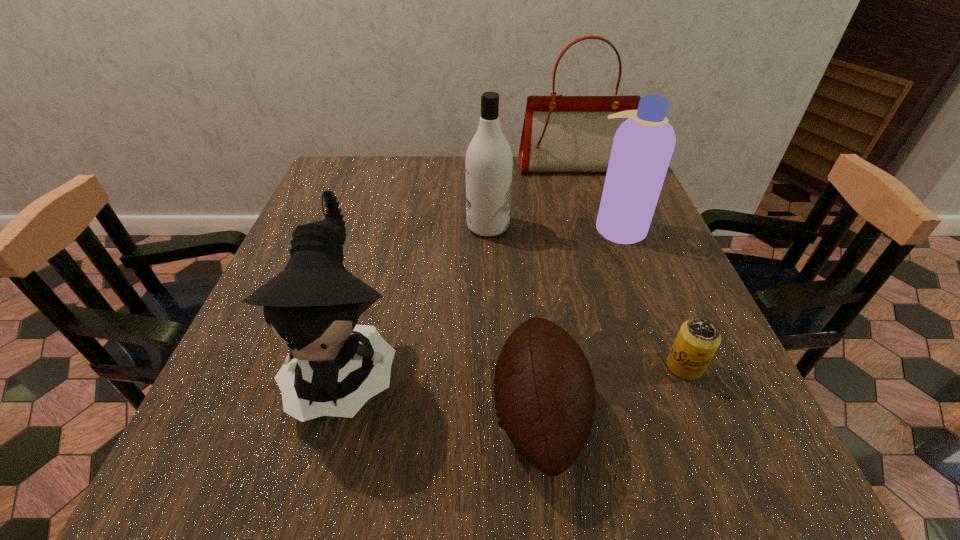
Identify the location of shampoo present at the right edge. (643, 145).

Locate an element on the screen. beer can that is at the right edge is located at coordinates (698, 339).

Locate an element on the screen. The width and height of the screenshot is (960, 540). object that is at the far right corner is located at coordinates (561, 134).

In the image, there is a desktop. What are the coordinates of `vacant space at the far edge` in the screenshot? It's located at (435, 174).

In the image, there is a desktop. Where is `vacant space at the near edge`? vacant space at the near edge is located at coordinates (421, 497).

At what (x,y) coordinates should I click in order to perform the action: click on vacant space at the left edge. Please return your answer as a coordinate pair (x, y). This screenshot has width=960, height=540. Looking at the image, I should click on (262, 353).

The width and height of the screenshot is (960, 540). What are the coordinates of `vacant region at the right edge of the desktop` in the screenshot? It's located at (634, 290).

In the image, there is a desktop. Identify the location of vacant space at the far left corner. (369, 186).

Locate an element on the screen. This screenshot has height=540, width=960. free space at the near right corner is located at coordinates (682, 467).

You are a GUI agent. You are given a task and a screenshot of the screen. Output one action in this format:
    pyautogui.click(x=<x>, y=<y>)
    Task: Click on the empty location between the handbag and the leftmost object
    This screenshot has width=960, height=540.
    Given the screenshot: What is the action you would take?
    pyautogui.click(x=460, y=266)